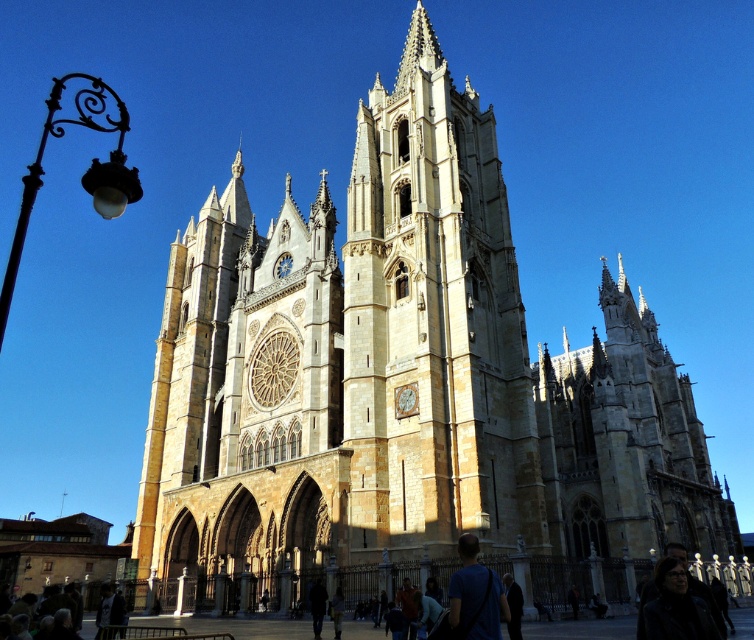
Between dark leather jacket at lower right and blue t-shirt at center, which one has more height?

Standing taller between the two is dark leather jacket at lower right.

Is dark leather jacket at lower right positioned behind blue t-shirt at center?

That is False.

Does point (642, 605) come closer to viewer compared to point (477, 602)?

No, it is behind (477, 602).

Locate an element on the screen. This screenshot has width=754, height=640. dark leather jacket at lower right is located at coordinates (673, 608).

Looking at this image, who is taller, light beige stone tower at center or dark leather jacket at lower right?

Standing taller between the two is light beige stone tower at center.

Is point (477, 364) positioned behind point (679, 608)?

Yes, point (477, 364) is behind point (679, 608).

The height and width of the screenshot is (640, 754). What are the coordinates of `light beige stone tower at center` in the screenshot? It's located at (434, 326).

Where is `light beige stone tower at center`? The width and height of the screenshot is (754, 640). light beige stone tower at center is located at coordinates (434, 326).

Who is higher up, light beige stone tower at center or blue t-shirt at center?

light beige stone tower at center is higher up.

What do you see at coordinates (434, 326) in the screenshot? I see `light beige stone tower at center` at bounding box center [434, 326].

Find the location of `light beige stone tower at center`. light beige stone tower at center is located at coordinates (434, 326).